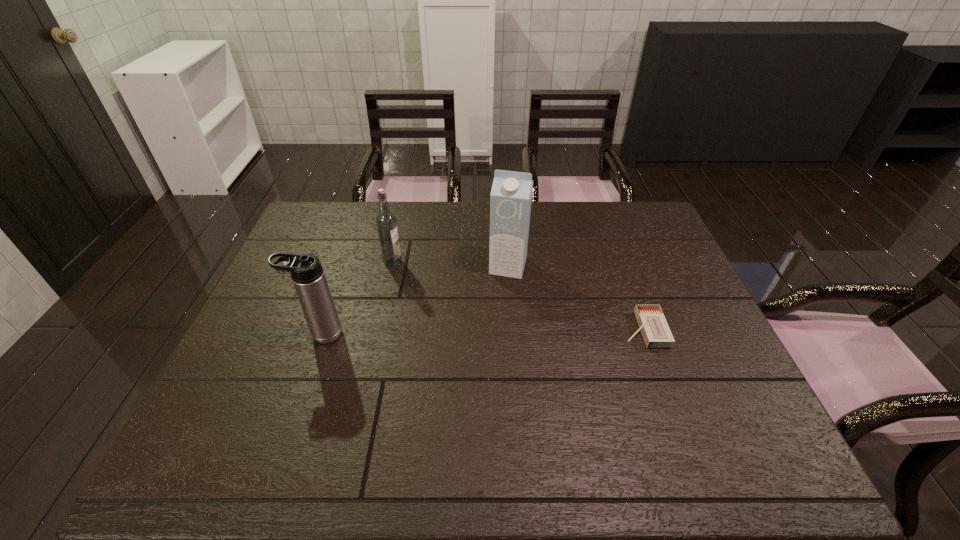
What are the coordinates of `vacant space located 0.320m on the striking surface of the shortest object` in the screenshot? It's located at (501, 329).

Identify the location of free space located on the striking surface of the shortest object. The height and width of the screenshot is (540, 960). (505, 329).

Find the location of `free space located 0.260m on the front label of the third object from left to right`. free space located 0.260m on the front label of the third object from left to right is located at coordinates (486, 347).

The height and width of the screenshot is (540, 960). What are the coordinates of `free space located 0.330m on the front label of the third object from left to right` in the screenshot? It's located at (480, 369).

The width and height of the screenshot is (960, 540). In order to click on vacant region located 0.180m on the front label of the third object from left to right in this screenshot , I will do `click(492, 323)`.

Locate an element on the screen. free spot located on the label of the third object from right to left is located at coordinates (468, 321).

The image size is (960, 540). I want to click on free location located on the label of the third object from right to left, so click(463, 317).

This screenshot has width=960, height=540. I want to click on vacant area situated on the label of the third object from right to left, so click(434, 294).

I want to click on object situated at the left edge, so click(x=307, y=274).

The height and width of the screenshot is (540, 960). Find the location of `object present at the right edge`. object present at the right edge is located at coordinates (654, 328).